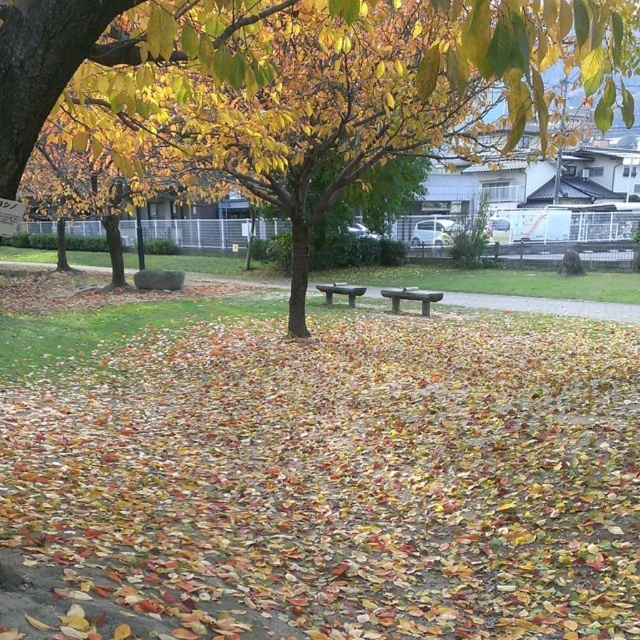
Can you confirm if yellow-green leaves at upper center is bigger than smooth gray bench at center?

Yes, yellow-green leaves at upper center is bigger than smooth gray bench at center.

Which is behind, point (93, 3) or point (410, 291)?

The point (410, 291) is more distant.

Find the location of a particular element. This screenshot has width=640, height=640. yellow-green leaves at upper center is located at coordinates (403, 88).

Is multicolored leaf litter at center shorter than yellow-green leaves at upper center?

Indeed, multicolored leaf litter at center has a lesser height compared to yellow-green leaves at upper center.

Does point (134, 560) come closer to viewer compared to point (186, 150)?

That is True.

Describe the element at coordinates (340, 474) in the screenshot. I see `multicolored leaf litter at center` at that location.

I want to click on multicolored leaf litter at center, so click(340, 474).

Is yellow-green leaves at upper center wider than green stone bench at center?

Indeed, yellow-green leaves at upper center has a greater width compared to green stone bench at center.

Can you confirm if yellow-green leaves at upper center is bigger than green stone bench at center?

Correct, yellow-green leaves at upper center is larger in size than green stone bench at center.

The width and height of the screenshot is (640, 640). What are the coordinates of `yellow-green leaves at upper center` in the screenshot? It's located at (403, 88).